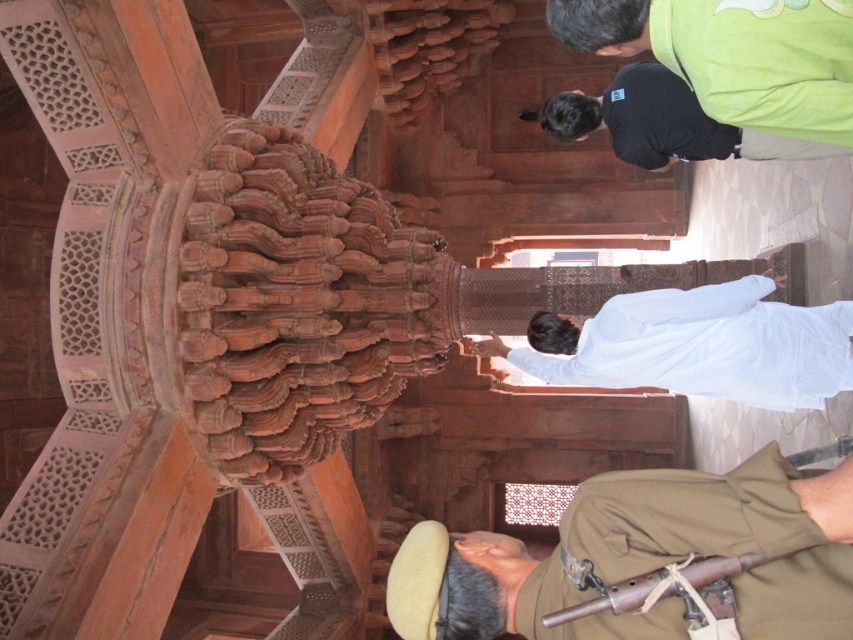
Looking at this image, you are an architect examining the intricate carvings on the column. You notice two points marked on the column. The first point is at coordinates point (x=643, y=518) and the second is at point (x=772, y=141). Which of these two points is nearer to your viewpoint as you look at the column?

Point (x=643, y=518) is closer to the camera than point (x=772, y=141), so the first point is nearer to your viewpoint.

You are an interior designer observing the intricate carvings on the column and ceiling of this historical building. You notice two shirts displayed in the scene for a photoshoot. The white cotton shirt at center and the dark green shirt at upper center. Which shirt is positioned lower in the scene?

The white cotton shirt at center is shorter than the dark green shirt at upper center, meaning it is positioned lower in the scene.